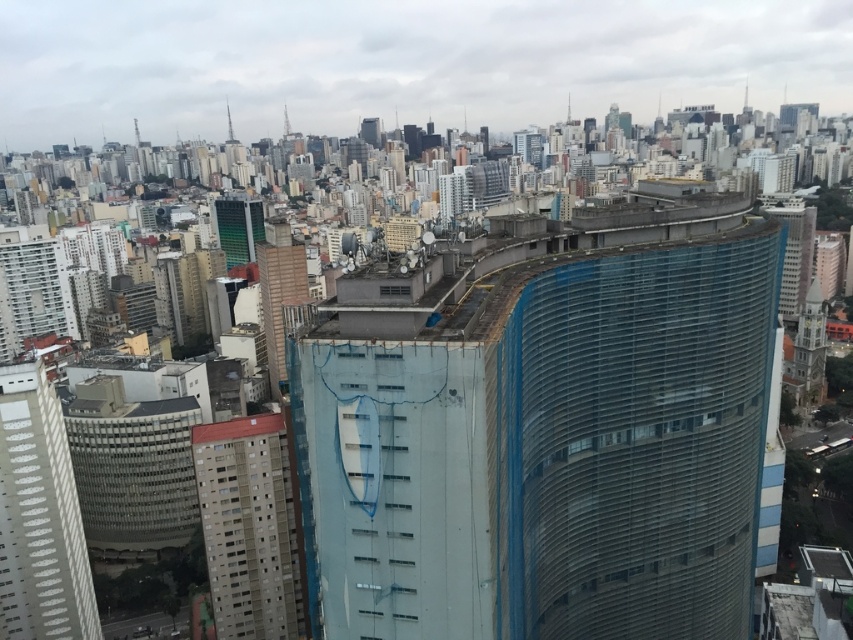
Question: Estimate the real-world distances between objects in this image. Which object is closer to the white textured building at lower left?

Choices:
 (A) green glass tower at center
 (B) transparent glass tower at center

Answer: (B)

Question: Which of the following is the farthest from the observer?

Choices:
 (A) white textured building at lower left
 (B) transparent glass tower at center
 (C) gray concrete building at center-left

Answer: (C)

Question: Does white textured building at lower left lie behind gray concrete building at center-left?

Choices:
 (A) no
 (B) yes

Answer: (A)

Question: Which object is closer to the camera taking this photo?

Choices:
 (A) white textured building at lower left
 (B) transparent glass tower at center

Answer: (B)

Question: Does transparent glass tower at center have a lesser width compared to green glass tower at center?

Choices:
 (A) yes
 (B) no

Answer: (A)

Question: Does gray concrete building at center-left have a larger size compared to green glass tower at center?

Choices:
 (A) no
 (B) yes

Answer: (A)